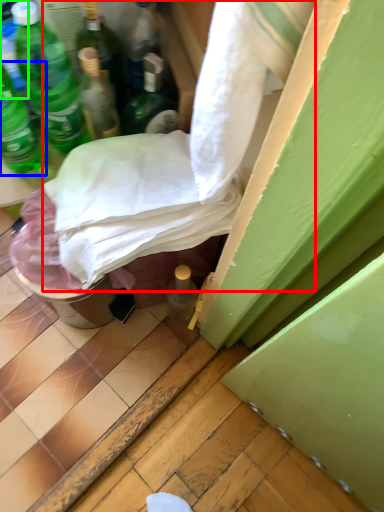
Question: Which object is positioned farthest from sheet (highlighted by a red box)? Select from bottle (highlighted by a blue box) and bottle (highlighted by a green box).

Choices:
 (A) bottle
 (B) bottle

Answer: (B)